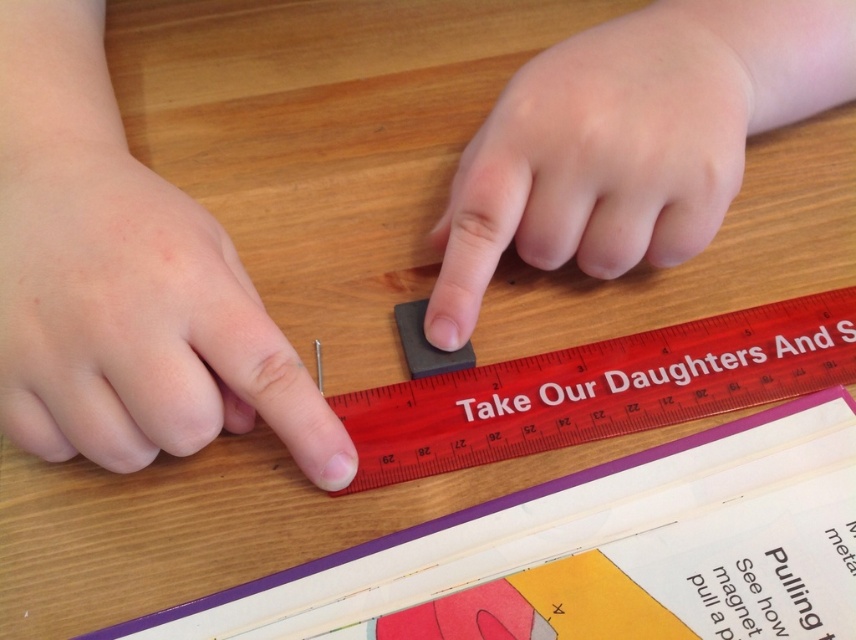
You are a child trying to touch the red plastic ruler at center with your smooth skin finger at center. Can you reach it without moving your hand?

The smooth skin finger at center and red plastic ruler at center are 5.37 inches apart. Since the distance is more than the typical reach without moving the hand, you cannot reach the red plastic ruler at center.